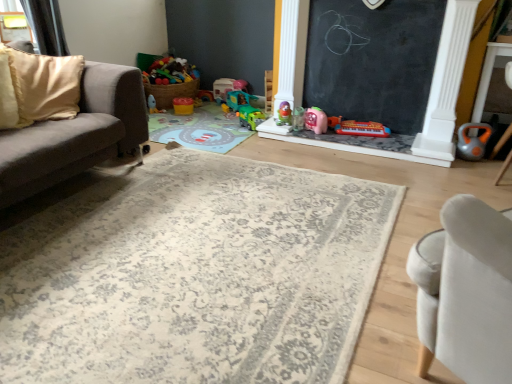
The image size is (512, 384). In order to click on free space to the left of green plastic toy car at center, placed as the seventh toy when sorted from right to left in this screenshot , I will do `click(211, 107)`.